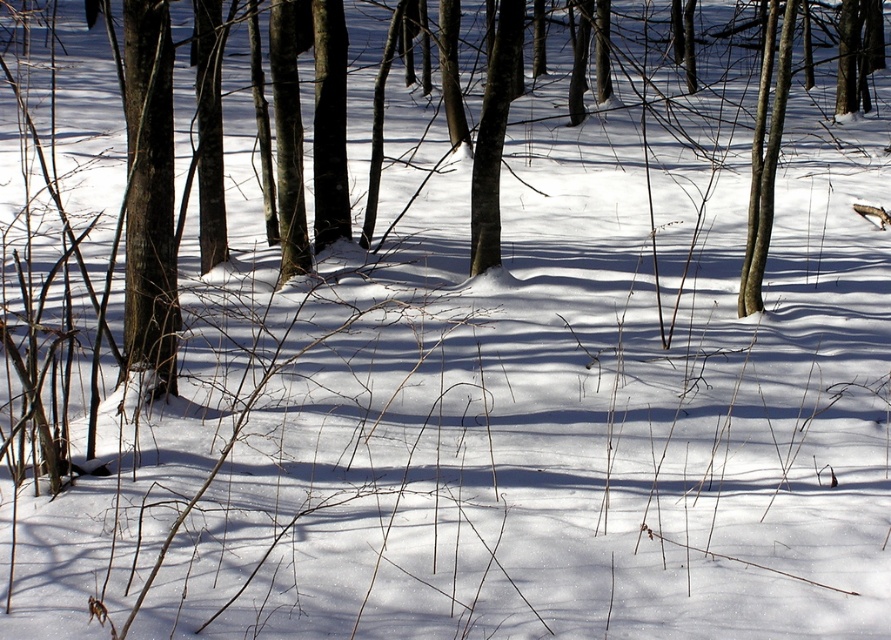
Question: Which object appears closest to the camera in this image?

Choices:
 (A) smooth bark tree at left
 (B) smooth bark tree at upper right
 (C) smooth bark tree at center

Answer: (A)

Question: Does smooth bark tree at left have a smaller size compared to smooth bark tree at upper right?

Choices:
 (A) yes
 (B) no

Answer: (B)

Question: Which point is farther to the camera?

Choices:
 (A) (481, 141)
 (B) (158, 291)
 (C) (754, 273)

Answer: (A)

Question: In this image, where is smooth bark tree at left located relative to smooth bark tree at center?

Choices:
 (A) right
 (B) left

Answer: (B)

Question: Is smooth bark tree at center further to camera compared to smooth bark tree at upper right?

Choices:
 (A) no
 (B) yes

Answer: (B)

Question: Based on their relative distances, which object is nearer to the smooth bark tree at center?

Choices:
 (A) smooth bark tree at left
 (B) smooth bark tree at upper right

Answer: (B)